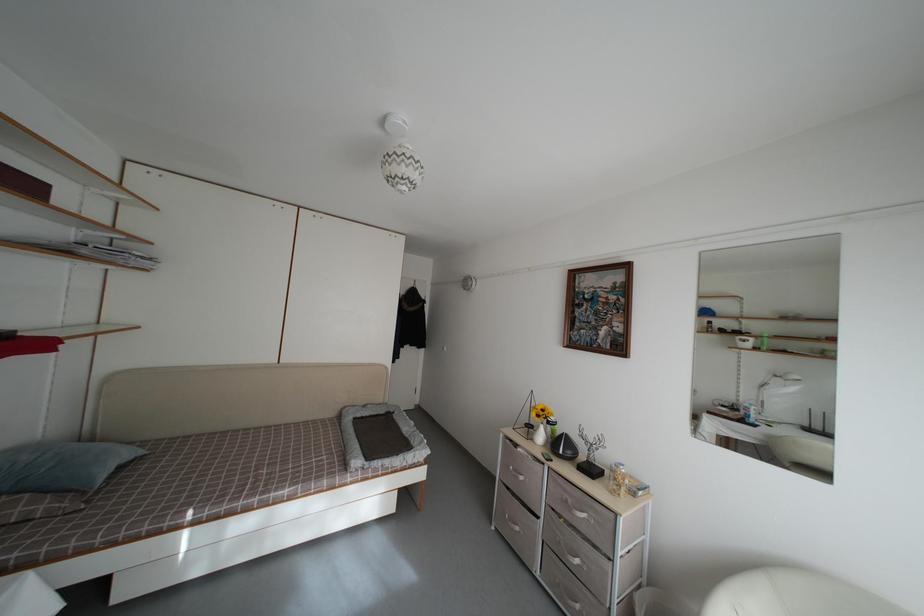
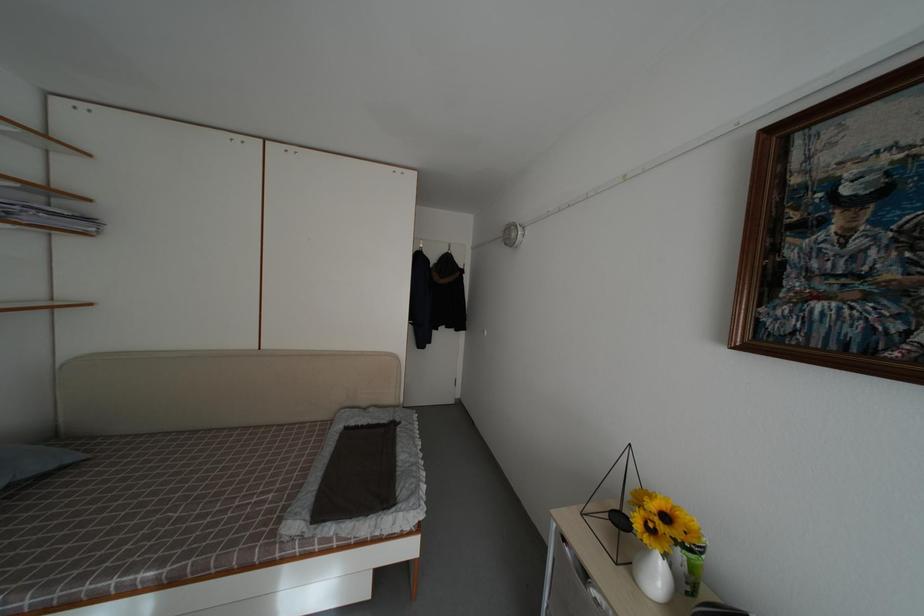
The point at (134,460) is marked in the first image. Where is the corresponding point in the second image?

(50, 469)